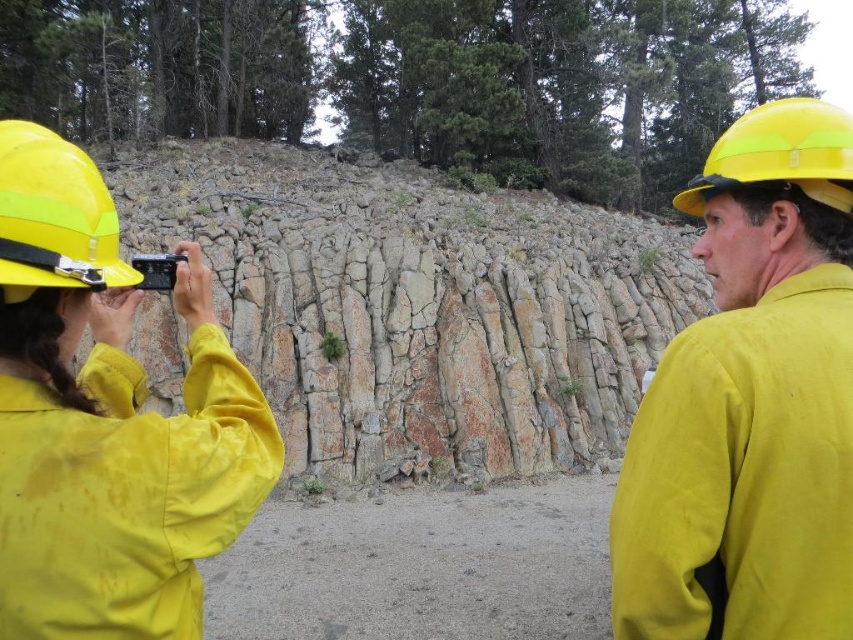
You are a safety inspector and need to ensure the two workers are at a safe distance from each other. According to safety regulations, workers must maintain a minimum distance of 5 feet apart to avoid collision risks. Are the yellow matte hard hat at upper right and yellow matte hard hat at left positioned safely?

The yellow matte hard hat at upper right and yellow matte hard hat at left are 7.63 feet apart from each other, which exceeds the required 5 feet minimum distance. Therefore, they are positioned safely.

You are a safety inspector evaluating the scene. You notice two yellow protective headgear items. Which one is nearer to you, the yellow matte hard hat at left or the yellow matte helmet at upper right?

The yellow matte hard hat at left is closer to the viewer than the yellow matte helmet at upper right.

Please provide the 2D coordinates of the yellow matte hard hat at upper right in the image. The scene includes two people in yellow safety gear near a rock formation with layered strata. The hard hat is located at upper right. Please answer with the coordinates in the format of a point like this example format, e.g., point at 0.627, 0.882. The answer must be precise and only include the numbers and commas.

The 2D coordinates of the yellow matte hard hat at upper right are point at (751, 401).